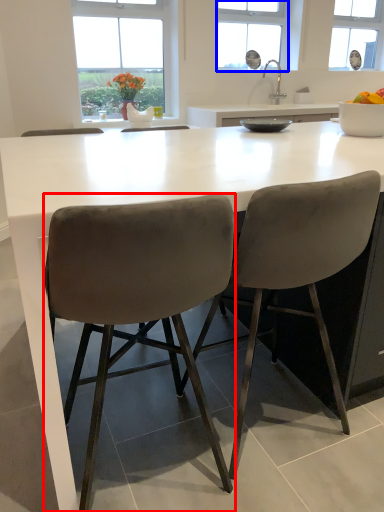
Question: Which point is further to the camera, chair (highlighted by a red box) or window (highlighted by a blue box)?

Choices:
 (A) chair
 (B) window

Answer: (B)